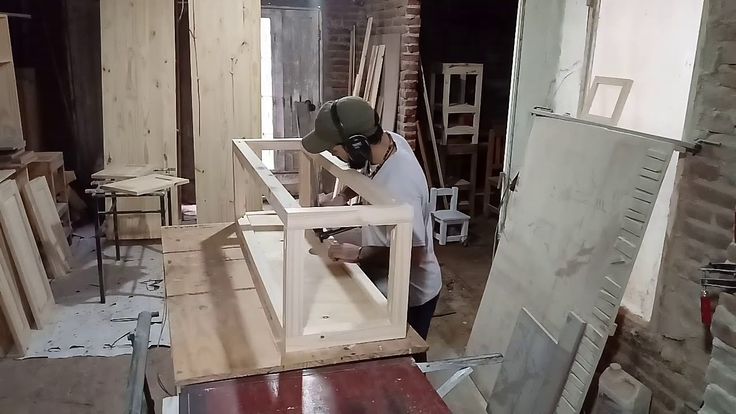
Where is `cabinet door`? This screenshot has width=736, height=414. cabinet door is located at coordinates [59, 235], [34, 269], [10, 302], [140, 182], [124, 172].